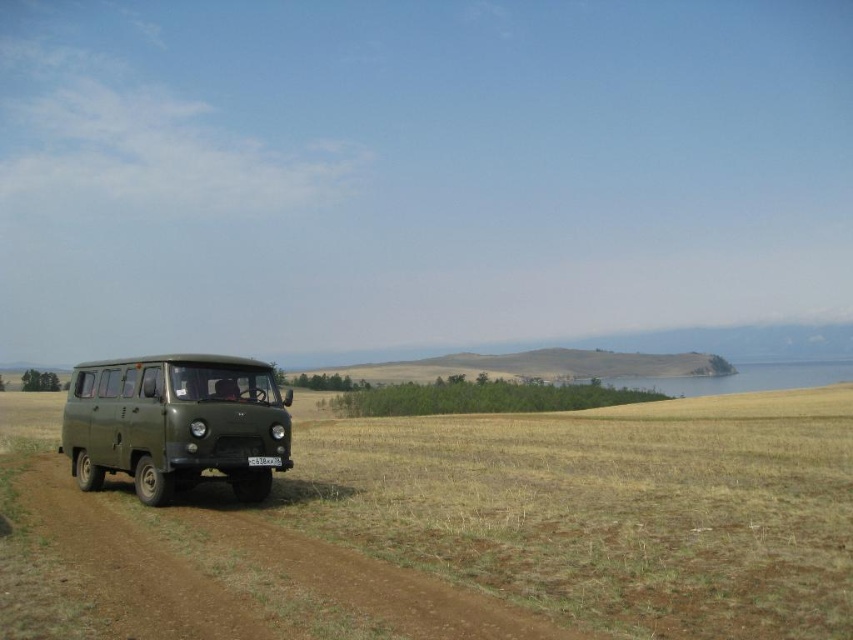
Question: Is matte green van at left to the left of black plastic license plate at center from the viewer's perspective?

Choices:
 (A) no
 (B) yes

Answer: (B)

Question: Which object is closer to the camera taking this photo?

Choices:
 (A) black plastic license plate at center
 (B) matte green van at left

Answer: (B)

Question: Which point is closer to the camera?

Choices:
 (A) (178, 609)
 (B) (251, 456)
 (C) (250, 394)

Answer: (A)

Question: Which is nearer to the brown dirt track at lower left?

Choices:
 (A) matte green van at left
 (B) black plastic license plate at center

Answer: (B)

Question: Is brown dirt track at lower left thinner than matte green van at left?

Choices:
 (A) no
 (B) yes

Answer: (A)

Question: Is brown dirt track at lower left further to the viewer compared to black plastic license plate at center?

Choices:
 (A) no
 (B) yes

Answer: (A)